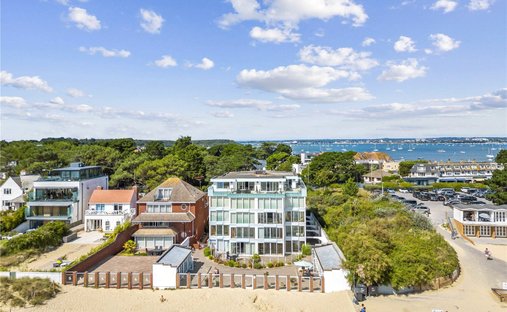
At what (x,y) coordinates should I click in order to perform the action: click on windows. Please return your answer as a coordinate pair (x, y). The width and height of the screenshot is (507, 312). Looking at the image, I should click on (254, 200), (289, 253), (163, 212), (160, 236), (184, 207), (103, 212), (56, 196), (51, 207), (8, 190).